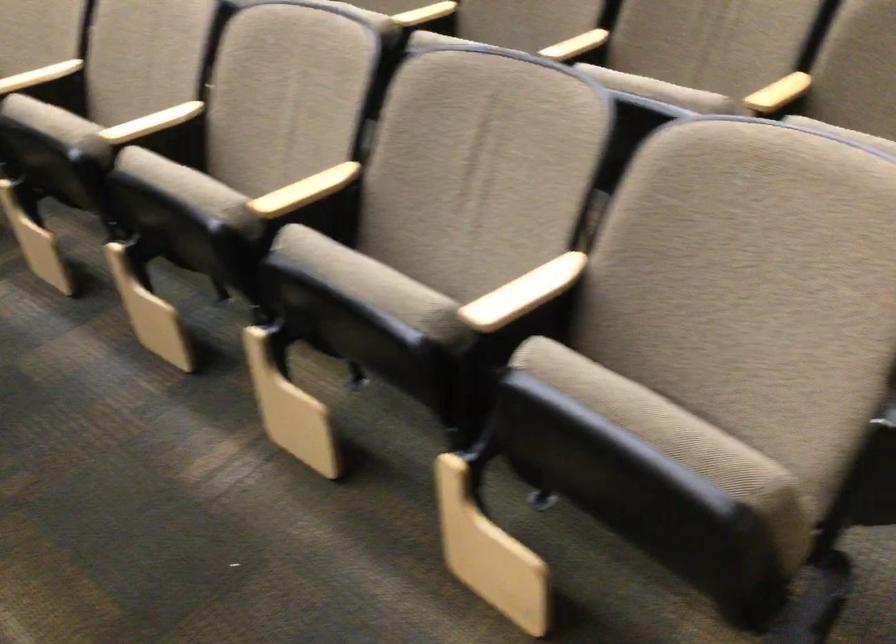
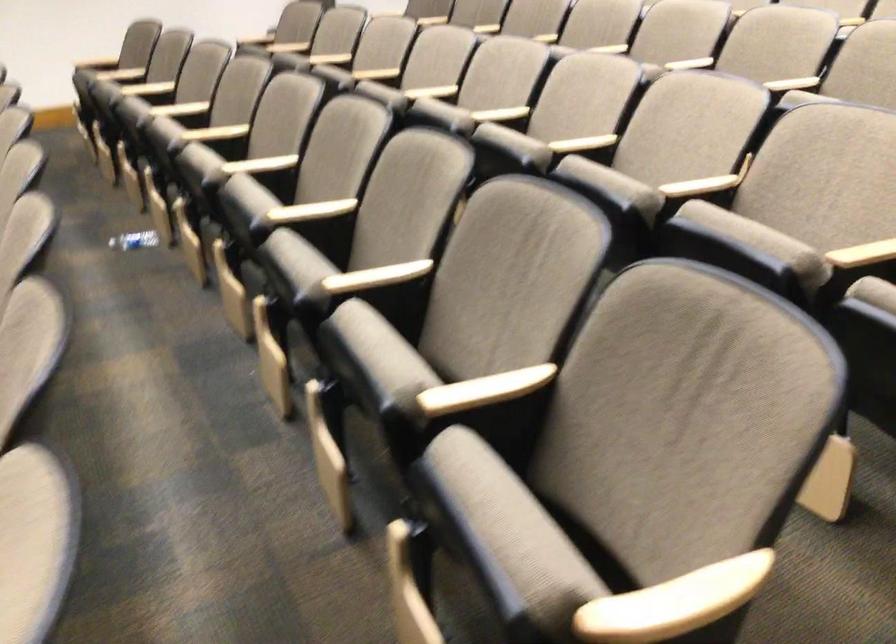
From the picture: In a continuous first-person perspective shot, in which direction is the camera moving?

The cameraman moved toward right, forward.